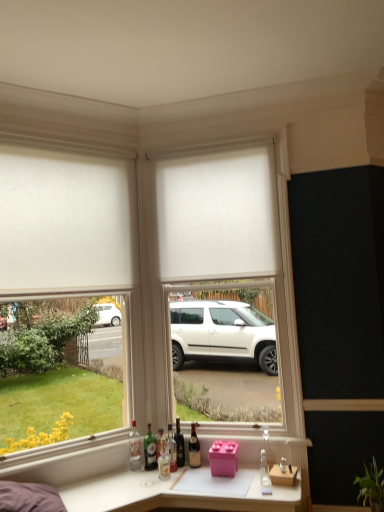
The image size is (384, 512). I want to click on vacant space situated above white matte roller blind at upper left (from a real-world perspective), so click(59, 146).